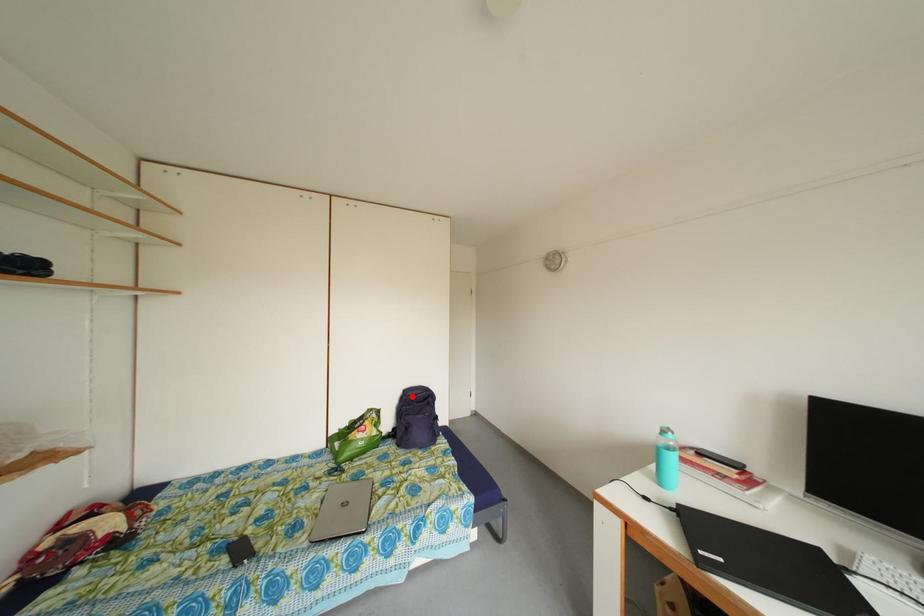
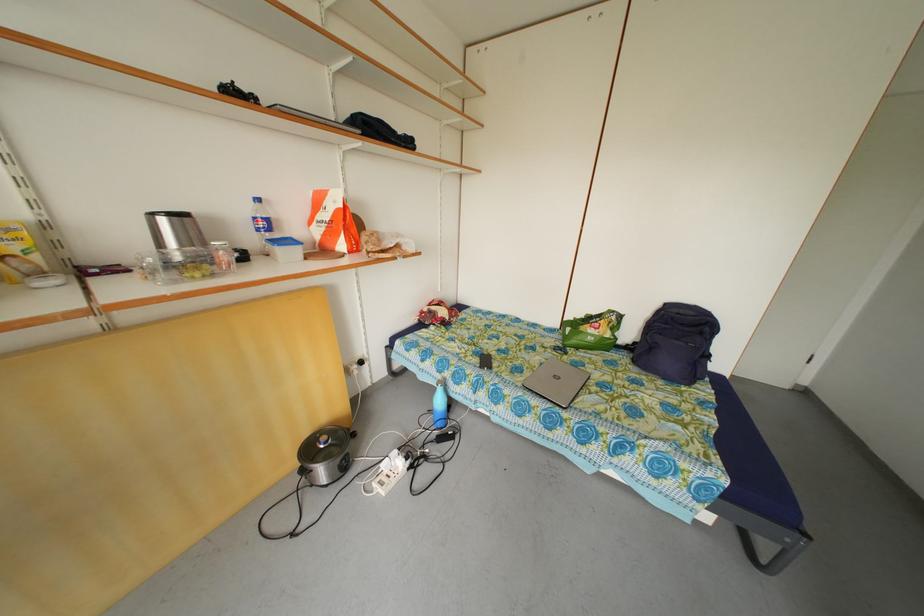
Where in the second image is the point corresponding to the highlighted location from the first image?

(673, 310)